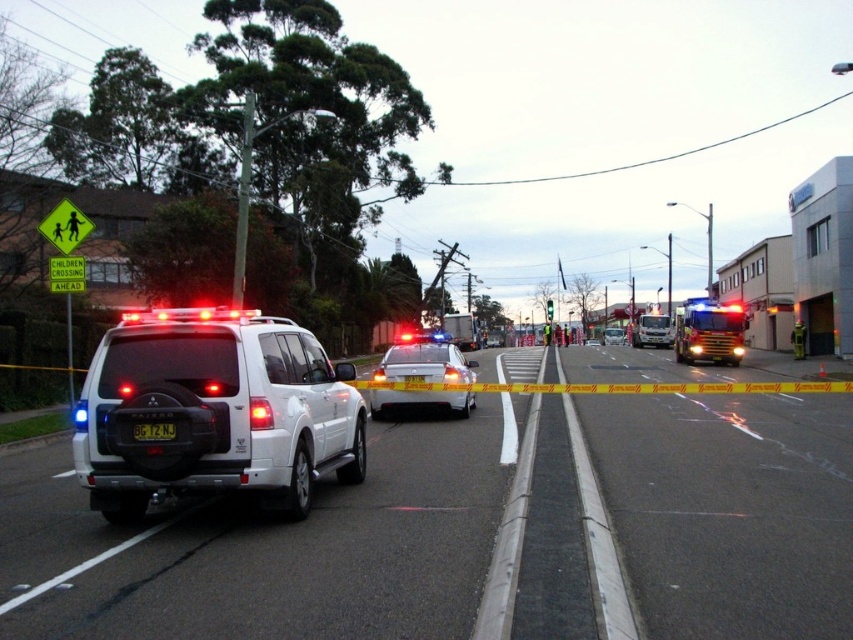
Based on the photo, which of these two, shiny red fire truck at center or white matte police car at center, stands taller?

shiny red fire truck at center is taller.

Between shiny red fire truck at center and white matte police car at center, which one is positioned lower?

white matte police car at center is below.

Between point (721, 320) and point (595, 339), which one is positioned behind?

The point (595, 339) is more distant.

Image resolution: width=853 pixels, height=640 pixels. Find the location of `shiny red fire truck at center`. shiny red fire truck at center is located at coordinates (708, 332).

Is shiny red fire truck at center to the left of white glossy sedan at center from the viewer's perspective?

Correct, you'll find shiny red fire truck at center to the left of white glossy sedan at center.

Between shiny red fire truck at center and white glossy sedan at center, which one appears on the right side from the viewer's perspective?

white glossy sedan at center is more to the right.

Image resolution: width=853 pixels, height=640 pixels. I want to click on shiny red fire truck at center, so click(x=708, y=332).

Identify the location of shiny red fire truck at center. The height and width of the screenshot is (640, 853). (708, 332).

Does shiny silver sedan at center have a greater height compared to shiny red fire truck at center?

Incorrect, shiny silver sedan at center's height is not larger of shiny red fire truck at center's.

Locate an element on the screen. The image size is (853, 640). shiny silver sedan at center is located at coordinates (424, 364).